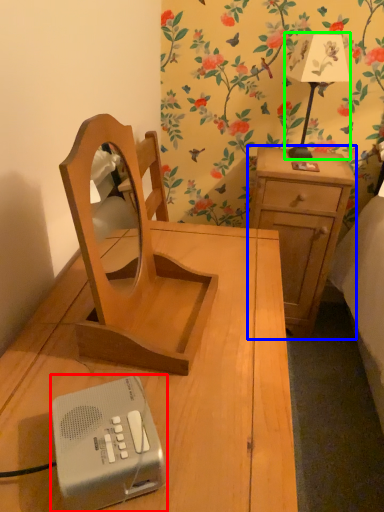
Question: Considering the real-world distances, which object is farthest from gadget (highlighted by a red box)? nightstand (highlighted by a blue box) or bedside lamp (highlighted by a green box)?

Choices:
 (A) nightstand
 (B) bedside lamp

Answer: (B)